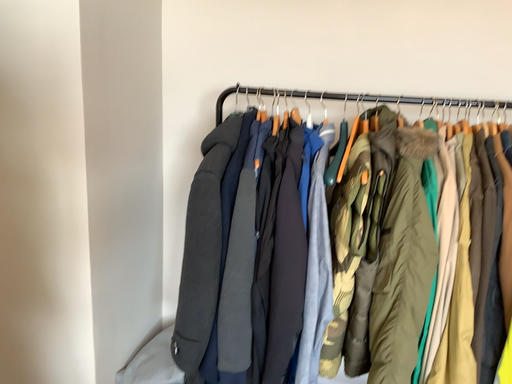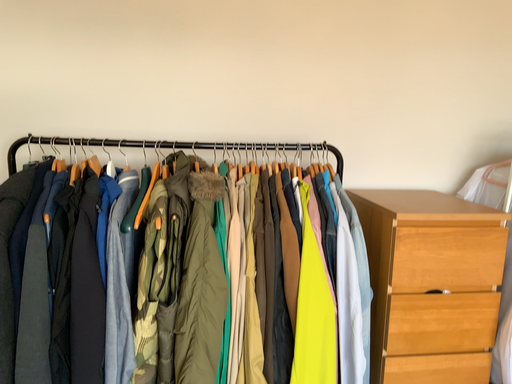
Question: Which way did the camera rotate in the video?

Choices:
 (A) rotated right
 (B) rotated left

Answer: (A)